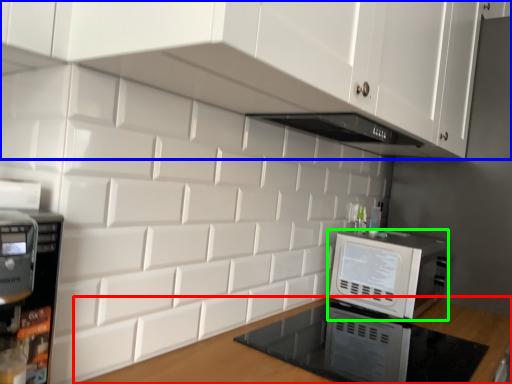
Question: Considering the real-world distances, which object is closest to countertop (highlighted by a red box)? cabinetry (highlighted by a blue box) or home appliance (highlighted by a green box).

Choices:
 (A) cabinetry
 (B) home appliance

Answer: (B)